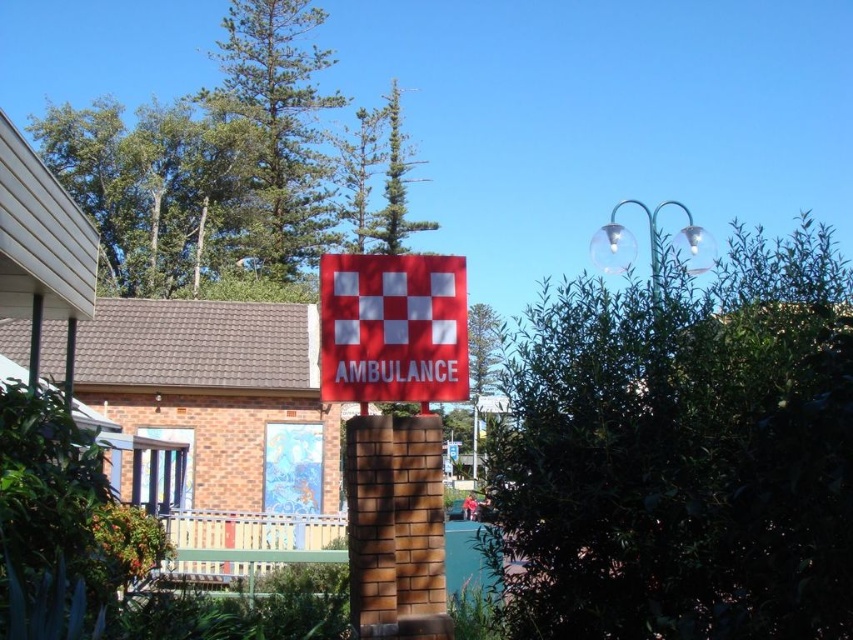
Question: Which object is the farthest from the red matte sign at center?

Choices:
 (A) green leafy tree at upper center
 (B) green leafy bush at center

Answer: (A)

Question: Is green leafy tree at upper center bigger than red matte sign at center?

Choices:
 (A) no
 (B) yes

Answer: (B)

Question: Does green leafy bush at center come in front of red matte sign at center?

Choices:
 (A) yes
 (B) no

Answer: (A)

Question: Is green leafy bush at center smaller than red matte sign at center?

Choices:
 (A) no
 (B) yes

Answer: (A)

Question: Estimate the real-world distances between objects in this image. Which object is farther from the red matte sign at center?

Choices:
 (A) green leafy tree at upper center
 (B) green leafy bush at center

Answer: (A)

Question: Based on their relative distances, which object is farther from the green leafy tree at upper center?

Choices:
 (A) red matte sign at center
 (B) green leafy bush at center

Answer: (B)